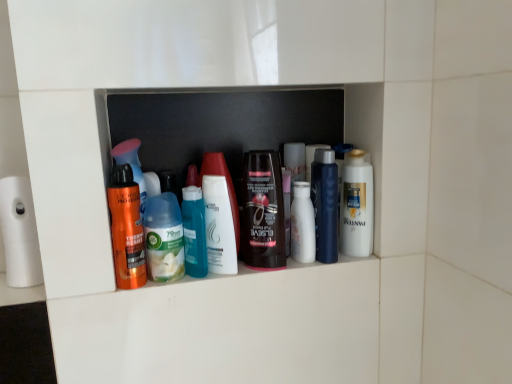
Question: Does white matte toilet paper at left have a smaller size compared to translucent plastic bottles at center?

Choices:
 (A) yes
 (B) no

Answer: (A)

Question: Would you say white matte toilet paper at left is a long distance from translucent plastic bottles at center?

Choices:
 (A) no
 (B) yes

Answer: (A)

Question: Considering the relative sizes of white matte toilet paper at left and translucent plastic bottles at center in the image provided, is white matte toilet paper at left wider than translucent plastic bottles at center?

Choices:
 (A) no
 (B) yes

Answer: (B)

Question: From a real-world perspective, is white matte toilet paper at left below translucent plastic bottles at center?

Choices:
 (A) yes
 (B) no

Answer: (A)

Question: Would you say translucent plastic bottles at center is part of white matte toilet paper at left's contents?

Choices:
 (A) yes
 (B) no

Answer: (B)

Question: From a real-world perspective, is white glossy lotion at center, which is the second toiletry from right to left, positioned above or below white glossy lotion at center, the third toiletry viewed from the left?

Choices:
 (A) above
 (B) below

Answer: (B)

Question: Would you say white glossy lotion at center, which is the second toiletry from right to left, is to the left or to the right of white glossy lotion at center, the third toiletry viewed from the left, in the picture?

Choices:
 (A) left
 (B) right

Answer: (B)

Question: From the image's perspective, relative to white glossy lotion at center, the third toiletry viewed from the left, is white glossy lotion at center, the fifth toiletry in the left-to-right sequence, above or below?

Choices:
 (A) above
 (B) below

Answer: (A)

Question: Is white glossy lotion at center, which is the second toiletry from right to left, situated inside white glossy lotion at center, the third toiletry viewed from the left, or outside?

Choices:
 (A) outside
 (B) inside

Answer: (A)

Question: Visually, is shiny brown bottle at center, placed as the 3th toiletry when sorted from right to left, positioned to the left or to the right of white glossy lotion at center, the fifth toiletry in the left-to-right sequence?

Choices:
 (A) right
 (B) left

Answer: (B)

Question: Is shiny brown bottle at center, the fourth toiletry from the left, bigger or smaller than white glossy lotion at center, the fifth toiletry in the left-to-right sequence?

Choices:
 (A) big
 (B) small

Answer: (A)

Question: From the image's perspective, relative to white glossy lotion at center, which is the second toiletry from right to left, is shiny brown bottle at center, the fourth toiletry from the left, above or below?

Choices:
 (A) above
 (B) below

Answer: (A)

Question: In terms of width, does shiny brown bottle at center, placed as the 3th toiletry when sorted from right to left, look wider or thinner when compared to white glossy lotion at center, which is the second toiletry from right to left?

Choices:
 (A) thin
 (B) wide

Answer: (B)

Question: From a real-world perspective, is shiny brown bottle at center, placed as the 3th toiletry when sorted from right to left, physically located above or below white glossy mouthwash at center right?

Choices:
 (A) below
 (B) above

Answer: (B)

Question: Is shiny brown bottle at center, placed as the 3th toiletry when sorted from right to left, taller or shorter than white glossy mouthwash at center right?

Choices:
 (A) tall
 (B) short

Answer: (A)